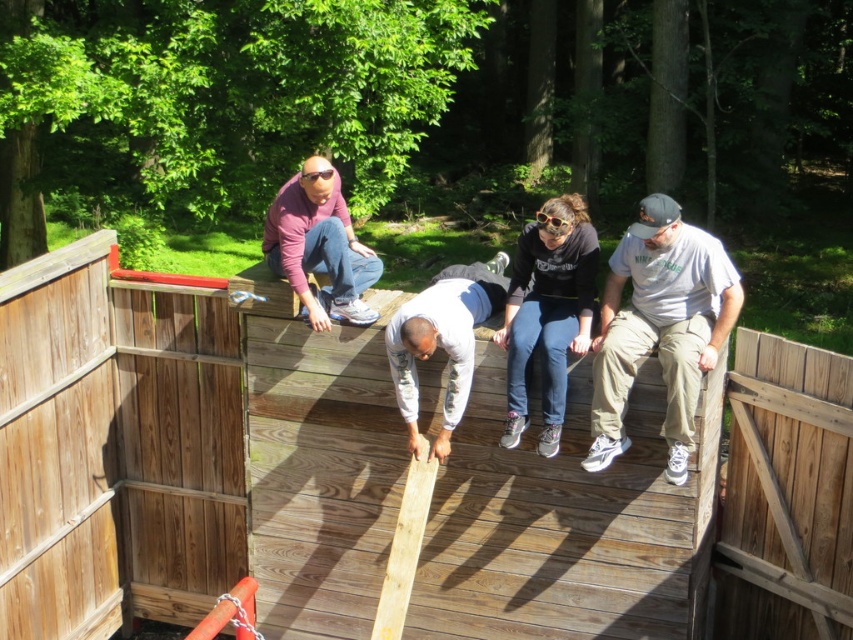
Question: Is gray cotton t-shirt at right closer to the viewer compared to matte purple shirt at upper center?

Choices:
 (A) yes
 (B) no

Answer: (A)

Question: Among these objects, which one is nearest to the camera?

Choices:
 (A) matte purple shirt at upper center
 (B) gray cotton t-shirt at right

Answer: (B)

Question: Does gray cotton t-shirt at right have a larger size compared to matte black hoodie at center?

Choices:
 (A) yes
 (B) no

Answer: (A)

Question: Which object is the farthest from the gray sweatpants at center?

Choices:
 (A) wooden deck at center
 (B) gray cotton t-shirt at right
 (C) matte black hoodie at center
 (D) matte purple shirt at upper center

Answer: (B)

Question: Is wooden deck at center to the left of gray sweatpants at center from the viewer's perspective?

Choices:
 (A) no
 (B) yes

Answer: (A)

Question: Which of the following is the farthest from the observer?

Choices:
 (A) (409, 394)
 (B) (384, 388)

Answer: (B)